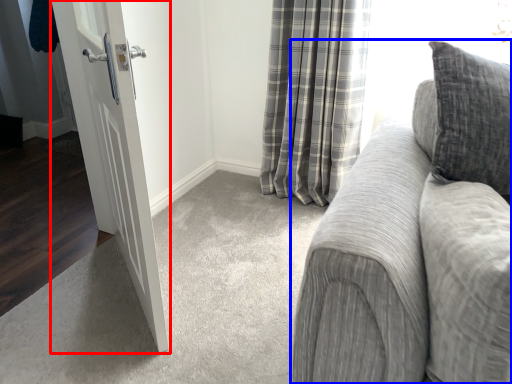
Question: Which of the following is the farthest to the observer, door (highlighted by a red box) or studio couch (highlighted by a blue box)?

Choices:
 (A) door
 (B) studio couch

Answer: (A)